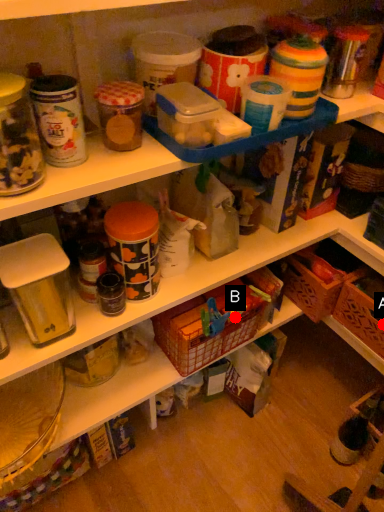
Question: Two points are circled on the image, labeled by A and B beside each circle. Which point appears closest to the camera in this image?

Choices:
 (A) A is closer
 (B) B is closer

Answer: (B)